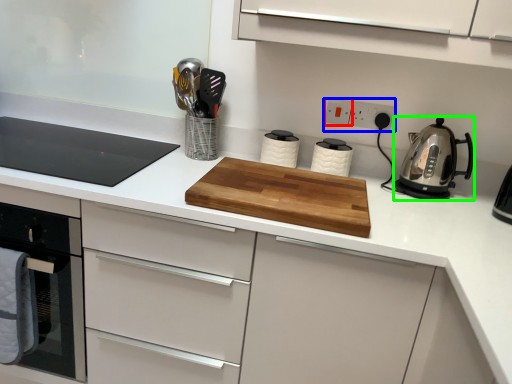
Question: Which object is the closest to the electric outlet (highlighted by a red box)? Choose among these: electric outlet (highlighted by a blue box) or kitchen appliance (highlighted by a green box).

Choices:
 (A) electric outlet
 (B) kitchen appliance

Answer: (A)